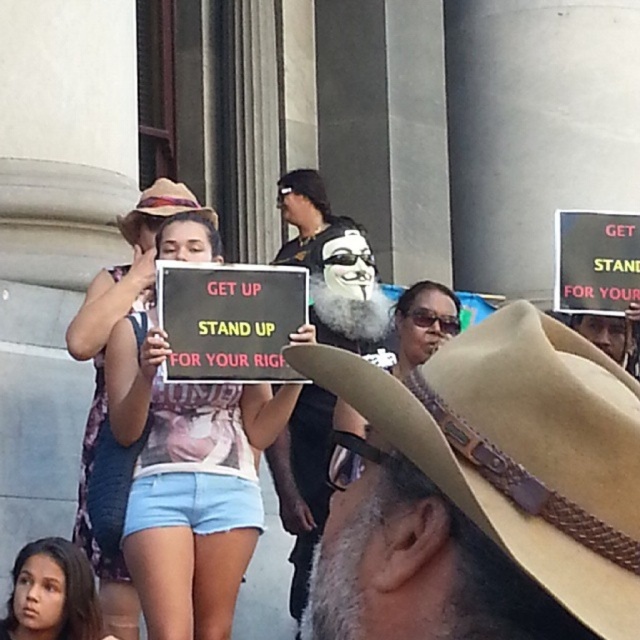
Which is above, matte black mask at center or light blue denim shorts at lower left?

matte black mask at center

Is point (339, 257) farther from viewer compared to point (28, 595)?

Yes, it is.

You are a GUI agent. You are given a task and a screenshot of the screen. Output one action in this format:
    pyautogui.click(x=<x>, y=<y>)
    Task: Click on the matte black mask at center
    
    Given the screenshot: What is the action you would take?
    pyautogui.click(x=332, y=266)

Does brown leather cowboy hat at lower right appear over brown straw cowboy hat at center?

No.

Who is shorter, brown leather cowboy hat at lower right or brown straw cowboy hat at center?

Standing shorter between the two is brown straw cowboy hat at center.

Is point (580, 509) closer to camera compared to point (141, 196)?

That is True.

Find the location of a particular element. This screenshot has width=640, height=640. brown leather cowboy hat at lower right is located at coordinates (484, 492).

Is point (177, 531) in front of point (45, 540)?

Yes, it is in front of point (45, 540).

From the picture: How distant is matte white tank top at center from light blue denim shorts at lower left?

matte white tank top at center is 14.01 feet away from light blue denim shorts at lower left.

Measure the distance between point (276, 397) and camera.

Point (276, 397) is 52.15 meters away from camera.

Identify the location of matte white tank top at center. Image resolution: width=640 pixels, height=640 pixels. (188, 484).